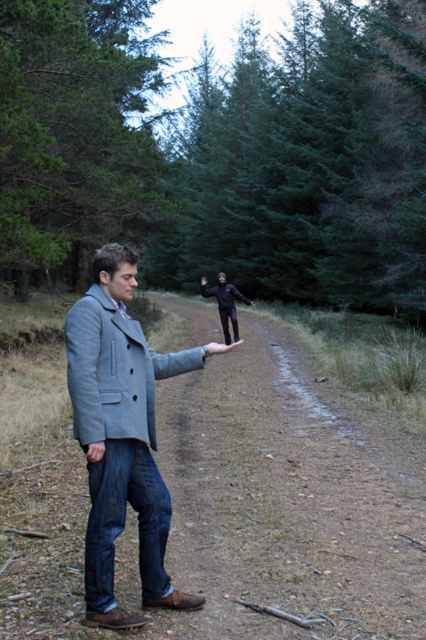
You are a GUI agent. You are given a task and a screenshot of the screen. Output one action in this format:
    pyautogui.click(x=<x>, y=<y>)
    Task: Click on the green textured pine forest at upper center
    The width and height of the screenshot is (426, 640).
    Given the screenshot: What is the action you would take?
    pyautogui.click(x=222, y=150)

Find the location of a particular element. The width and height of the screenshot is (426, 640). green textured pine forest at upper center is located at coordinates (222, 150).

The height and width of the screenshot is (640, 426). What do you see at coordinates (238, 509) in the screenshot?
I see `brown dirt track at center` at bounding box center [238, 509].

Does brown dirt track at center come in front of black matte pants at center?

Yes, brown dirt track at center is in front of black matte pants at center.

Which is behind, point (160, 616) or point (230, 317)?

The point (230, 317) is behind.

This screenshot has height=640, width=426. Find the location of `brown dirt track at center`. brown dirt track at center is located at coordinates (238, 509).

Does green textured pine forest at upper center lie in front of gray wool coat at center?

No.

Is point (120, 42) positioned in front of point (111, 320)?

No, (120, 42) is further to viewer.

Locate an element on the screen. green textured pine forest at upper center is located at coordinates (222, 150).